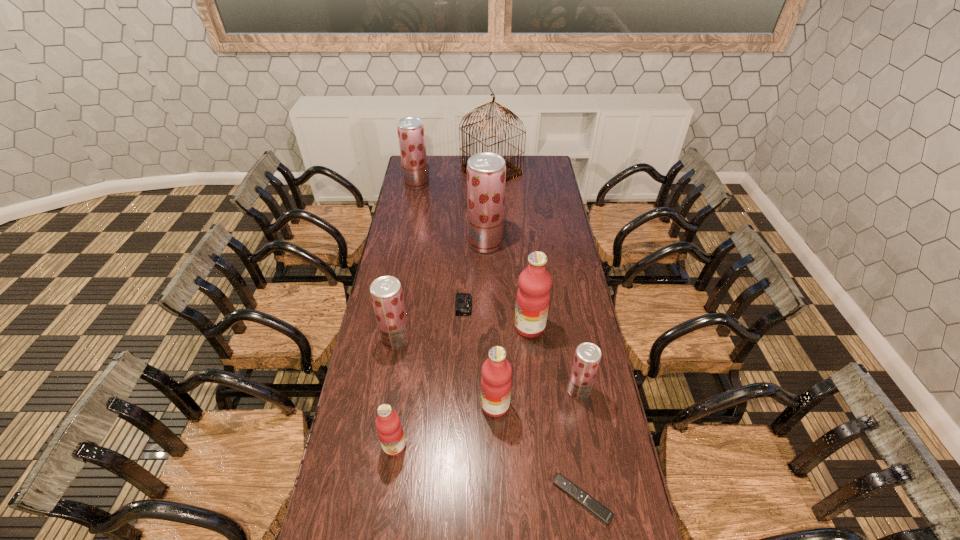
This screenshot has height=540, width=960. Find the location of `vacant area between the nearest pink fruit juice and the rightmost strawberry fruit juice`. vacant area between the nearest pink fruit juice and the rightmost strawberry fruit juice is located at coordinates [487, 418].

This screenshot has height=540, width=960. Identify the location of vacant space in between the alarm clock and the second nearest object. (429, 376).

Identify the location of free space that is in between the third farthest strawberry fruit juice and the second farthest fruit juice. The height and width of the screenshot is (540, 960). (441, 292).

This screenshot has height=540, width=960. What are the coordinates of `free space between the second smallest strawberry fruit juice and the second biggest pink fruit juice` in the screenshot? It's located at (445, 373).

Find the location of a particular element. vacant area that lies between the alarm clock and the second farthest strawberry fruit juice is located at coordinates (474, 274).

Locate an element on the screen. Image resolution: width=960 pixels, height=540 pixels. free spot between the birdcage and the smallest pink fruit juice is located at coordinates (443, 309).

Locate which object is the sixth closest to the alarm clock. Please provide its 2D coordinates. Your answer should be formatted as a tuple, i.e. [(x, y)], where the tuple contains the x and y coordinates of a point satisfying the conditions above.

[(389, 428)]

Locate which object ranks third in proximity to the birdcage. Please provide its 2D coordinates. Your answer should be formatted as a tuple, i.e. [(x, y)], where the tuple contains the x and y coordinates of a point satisfying the conditions above.

[(463, 304)]

Point out which fruit juice is positioned as the sixth nearest to the remote control. Please provide its 2D coordinates. Your answer should be formatted as a tuple, i.e. [(x, y)], where the tuple contains the x and y coordinates of a point satisfying the conditions above.

[(486, 172)]

At what (x,y) coordinates should I click in order to perform the action: click on the fifth closest fruit juice to the second pink fruit juice from right to left. Please return your answer as a coordinate pair (x, y). Looking at the image, I should click on 486,172.